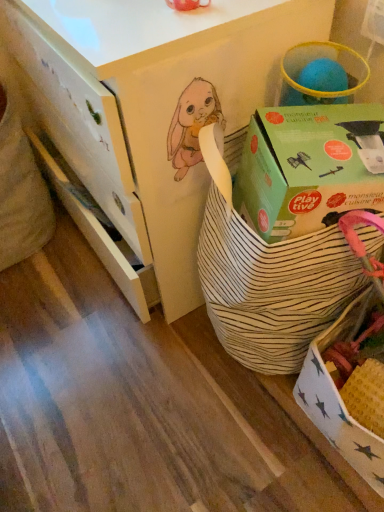
Question: Considering the relative sizes of white striped basket at center and green cardboard box at upper right in the image provided, is white striped basket at center bigger than green cardboard box at upper right?

Choices:
 (A) no
 (B) yes

Answer: (B)

Question: Is white striped basket at center thinner than green cardboard box at upper right?

Choices:
 (A) no
 (B) yes

Answer: (A)

Question: Is white striped basket at center next to green cardboard box at upper right?

Choices:
 (A) yes
 (B) no

Answer: (B)

Question: Is green cardboard box at upper right at the back of white striped basket at center?

Choices:
 (A) yes
 (B) no

Answer: (B)

Question: Does white striped basket at center contain green cardboard box at upper right?

Choices:
 (A) no
 (B) yes

Answer: (A)

Question: From the image's perspective, does white striped basket at center appear higher than green cardboard box at upper right?

Choices:
 (A) yes
 (B) no

Answer: (A)

Question: From a real-world perspective, is green cardboard box at upper right on white striped fabric basket at center?

Choices:
 (A) no
 (B) yes

Answer: (B)

Question: Considering the relative positions of green cardboard box at upper right and white striped fabric basket at center in the image provided, is green cardboard box at upper right to the left of white striped fabric basket at center from the viewer's perspective?

Choices:
 (A) no
 (B) yes

Answer: (B)

Question: Is green cardboard box at upper right next to white striped fabric basket at center?

Choices:
 (A) yes
 (B) no

Answer: (B)

Question: From the image's perspective, is green cardboard box at upper right above white striped fabric basket at center?

Choices:
 (A) no
 (B) yes

Answer: (B)

Question: Considering the relative sizes of green cardboard box at upper right and white striped fabric basket at center in the image provided, is green cardboard box at upper right smaller than white striped fabric basket at center?

Choices:
 (A) yes
 (B) no

Answer: (A)

Question: From a real-world perspective, is green cardboard box at upper right physically below white striped fabric basket at center?

Choices:
 (A) yes
 (B) no

Answer: (B)

Question: Is green cardboard box at upper right a part of white striped fabric basket at center?

Choices:
 (A) no
 (B) yes

Answer: (B)